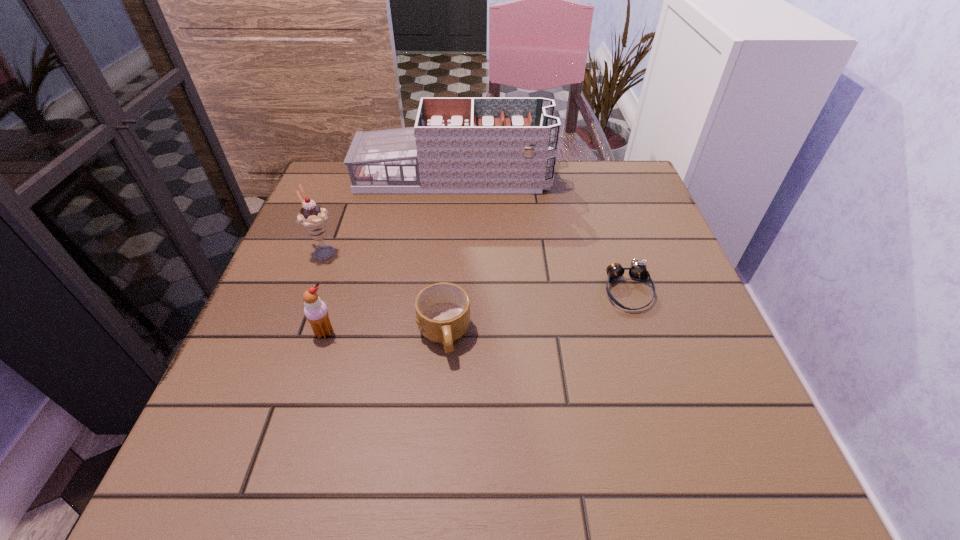
The height and width of the screenshot is (540, 960). In order to click on vacant space located at the front with a straw on the shorter icecream in this screenshot , I will do `click(300, 413)`.

Where is `free space located on the side with the handle of the mug`? The height and width of the screenshot is (540, 960). free space located on the side with the handle of the mug is located at coordinates (440, 396).

Locate an element on the screen. This screenshot has height=540, width=960. free space located through the lenses of the shortest object is located at coordinates click(686, 474).

Identify the location of object that is positioned at the far edge. This screenshot has width=960, height=540. (458, 145).

Where is `dollhouse that is at the left edge`? dollhouse that is at the left edge is located at coordinates click(458, 145).

Locate an element on the screen. The height and width of the screenshot is (540, 960). object positioned at the right edge is located at coordinates (637, 271).

You are a GUI agent. You are given a task and a screenshot of the screen. Output one action in this format:
    pyautogui.click(x=<x>, y=<y>)
    Task: Click on the object that is at the far left corner
    The height and width of the screenshot is (540, 960).
    Given the screenshot: What is the action you would take?
    pyautogui.click(x=458, y=145)

In the image, there is a desktop. Find the location of `vacant space at the far edge`. vacant space at the far edge is located at coordinates (447, 209).

This screenshot has height=540, width=960. What are the coordinates of `vacant space at the near edge of the desktop` in the screenshot? It's located at (418, 477).

Locate an element on the screen. The height and width of the screenshot is (540, 960). vacant region at the left edge of the desktop is located at coordinates (298, 306).